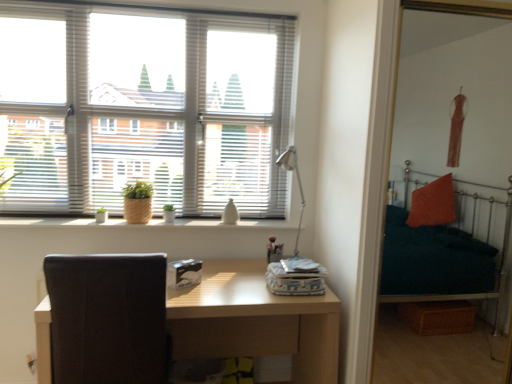
This screenshot has height=384, width=512. Find the location of `light brown wooden table at center`. light brown wooden table at center is located at coordinates (254, 321).

Find the location of a particular element. wooden textured window sill at center is located at coordinates (141, 224).

This screenshot has width=512, height=384. What do you see at coordinates (141, 224) in the screenshot?
I see `wooden textured window sill at center` at bounding box center [141, 224].

What is the approximate height of white blinds at upper left?

1.11 meters.

Where is `white blinds at upper left`? The image size is (512, 384). white blinds at upper left is located at coordinates (144, 108).

Image resolution: width=512 pixels, height=384 pixels. I want to click on teal fabric bunk bed at right, so click(x=435, y=11).

What are the coordinates of `metallic silver table lamp at center` in the screenshot? It's located at (297, 181).

I want to click on window sill below the braided straw pot at window (from a real-world perspective), so click(141, 224).

From the image's perspective, is braided straw pot at window on top of wooden textured window sill at center?

Yes, from the image's perspective, braided straw pot at window is above wooden textured window sill at center.

Considering the positions of objects braided straw pot at window and wooden textured window sill at center in the image provided, who is more to the left, braided straw pot at window or wooden textured window sill at center?

braided straw pot at window.

Which of these two, braided straw pot at window or wooden textured window sill at center, stands shorter?

wooden textured window sill at center is shorter.

Between point (378, 309) and point (149, 113), which one is positioned behind?

The point (378, 309) is more distant.

At what (x,y) coordinates should I click in order to perform the action: click on window on the left of the teal fabric bunk bed at right. Please return your answer as a coordinate pair (x, y). This screenshot has height=384, width=512. Looking at the image, I should click on (144, 108).

In terms of width, does teal fabric bunk bed at right look wider or thinner when compared to white blinds at upper left?

Clearly, teal fabric bunk bed at right has more width compared to white blinds at upper left.

Does teal fabric bunk bed at right appear on the right side of white blinds at upper left?

Yes.

Can you confirm if wooden textured window sill at center is wider than teal fabric bunk bed at right?

Yes.

From the image's perspective, between wooden textured window sill at center and teal fabric bunk bed at right, who is located below?

From the image's view, wooden textured window sill at center is below.

In the image, is wooden textured window sill at center on the left side or the right side of teal fabric bunk bed at right?

Clearly, wooden textured window sill at center is on the left of teal fabric bunk bed at right in the image.

Can you confirm if wooden textured window sill at center is shorter than teal fabric bunk bed at right?

Yes, wooden textured window sill at center is shorter than teal fabric bunk bed at right.

From the image's perspective, which is below, white blinds at upper left or braided straw pot at window?

braided straw pot at window, from the image's perspective.

Considering the points (161, 176) and (136, 214), which point is in front, point (161, 176) or point (136, 214)?

Positioned in front is point (136, 214).

Who is bigger, white blinds at upper left or braided straw pot at window?

white blinds at upper left is bigger.

Is white blinds at upper left far away from braided straw pot at window?

white blinds at upper left is near braided straw pot at window, not far away.

How different are the orientations of white blinds at upper left and black leather swivel chair at left in degrees?

The angle between the facing direction of white blinds at upper left and the facing direction of black leather swivel chair at left is 179 degrees.

Who is taller, white blinds at upper left or black leather swivel chair at left?

Standing taller between the two is white blinds at upper left.

Does point (176, 195) appear closer or farther from the camera than point (129, 360)?

Point (176, 195) is farther from the camera than point (129, 360).

Which of these two, black leather swivel chair at left or teal fabric bunk bed at right, stands taller?

With more height is teal fabric bunk bed at right.

Is black leather swivel chair at left positioned beyond the bounds of teal fabric bunk bed at right?

black leather swivel chair at left lies outside teal fabric bunk bed at right's area.

From a real-world perspective, is black leather swivel chair at left beneath teal fabric bunk bed at right?

Yes.

Is point (62, 301) positioned in front of point (505, 372)?

Yes, point (62, 301) is closer to viewer.

Consider the image. Can you tell me how much teal fabric bunk bed at right and black leather swivel chair at left differ in facing direction?

There is a 180-degree angle between the facing directions of teal fabric bunk bed at right and black leather swivel chair at left.

From a real-world perspective, does teal fabric bunk bed at right sit lower than black leather swivel chair at left?

Incorrect, from a real-world perspective, teal fabric bunk bed at right is higher than black leather swivel chair at left.

From the image's perspective, relative to black leather swivel chair at left, is teal fabric bunk bed at right above or below?

Based on their image positions, teal fabric bunk bed at right is located above black leather swivel chair at left.

This screenshot has height=384, width=512. Identify the location of houseplant lying behind the wooden textured window sill at center. tap(138, 202).

At what (x,y) coordinates should I click in order to perform the action: click on window above the teal fabric bunk bed at right (from a real-world perspective). Please return your answer as a coordinate pair (x, y). The height and width of the screenshot is (384, 512). Looking at the image, I should click on (144, 108).

Which object lies further to the anchor point white blinds at upper left, light brown wooden table at center or teal fabric bunk bed at right?

teal fabric bunk bed at right.

Estimate the real-world distances between objects in this image. Which object is closer to black leather swivel chair at left, teal fabric bunk bed at right or wooden textured window sill at center?

wooden textured window sill at center lies closer to black leather swivel chair at left than the other object.

Based on their spatial positions, is black leather swivel chair at left or wooden textured window sill at center closer to white blinds at upper left?

wooden textured window sill at center lies closer to white blinds at upper left than the other object.

Based on their spatial positions, is braided straw pot at window or wooden textured window sill at center further from white blinds at upper left?

wooden textured window sill at center is positioned further to the anchor white blinds at upper left.

Looking at the image, which one is located further to wooden textured window sill at center, braided straw pot at window or white blinds at upper left?

white blinds at upper left is positioned further to the anchor wooden textured window sill at center.

Based on their spatial positions, is teal fabric bunk bed at right or wooden textured window sill at center closer to metallic silver table lamp at center?

wooden textured window sill at center lies closer to metallic silver table lamp at center than the other object.

Which object lies further to the anchor point light brown wooden table at center, teal fabric bunk bed at right or braided straw pot at window?

teal fabric bunk bed at right is further to light brown wooden table at center.

Which object lies nearer to the anchor point teal fabric bunk bed at right, light brown wooden table at center or metallic silver table lamp at center?

Among the two, metallic silver table lamp at center is located nearer to teal fabric bunk bed at right.

Find the location of a particular element. This screenshot has width=512, height=384. table lamp between white blinds at upper left and black leather swivel chair at left in the vertical direction is located at coordinates (297, 181).

The height and width of the screenshot is (384, 512). In order to click on swivel chair between braided straw pot at window and metallic silver table lamp at center in this screenshot , I will do `click(108, 318)`.

Find the location of `window sill situated between black leather swivel chair at left and metallic silver table lamp at center from left to right`. window sill situated between black leather swivel chair at left and metallic silver table lamp at center from left to right is located at coordinates (141, 224).

At what (x,y) coordinates should I click in order to perform the action: click on window sill that lies between braided straw pot at window and light brown wooden table at center from top to bottom. Please return your answer as a coordinate pair (x, y). The height and width of the screenshot is (384, 512). Looking at the image, I should click on (141, 224).